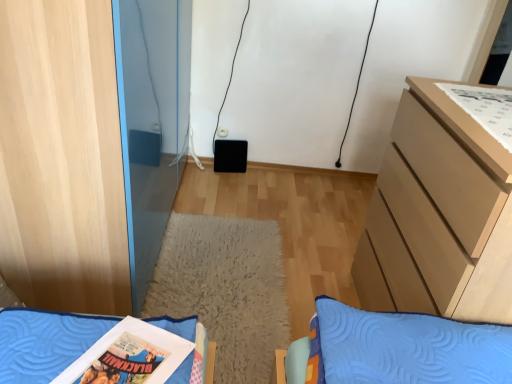
Question: From a real-world perspective, relative to white paper comic book at upper right, is light brown wooden chest of drawers at right vertically above or below?

Choices:
 (A) below
 (B) above

Answer: (A)

Question: In terms of size, does light brown wooden chest of drawers at right appear bigger or smaller than white paper comic book at upper right?

Choices:
 (A) small
 (B) big

Answer: (B)

Question: Which is nearer to the light wood cabinet at left?

Choices:
 (A) white paper comic book at upper right
 (B) white fluffy rug at center
 (C) blue quilted pillow at lower left
 (D) light brown wooden chest of drawers at right

Answer: (C)

Question: Which is farther from the blue quilted pillow at lower left?

Choices:
 (A) light wood cabinet at left
 (B) light brown wooden chest of drawers at right
 (C) white paper comic book at upper right
 (D) white fluffy rug at center

Answer: (C)